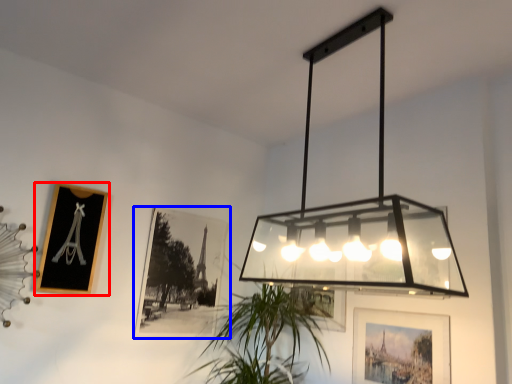
Question: Which of the following is the farthest to the observer, picture frame (highlighted by a red box) or picture frame (highlighted by a blue box)?

Choices:
 (A) picture frame
 (B) picture frame

Answer: (B)